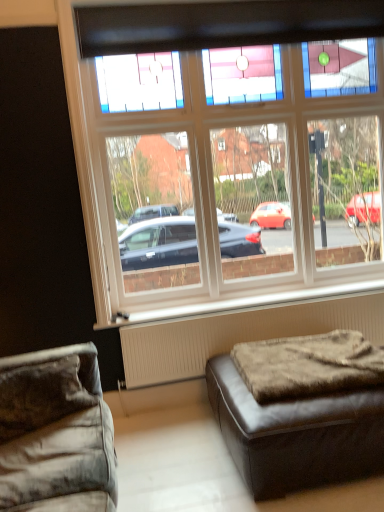
Question: From a real-world perspective, is white textured radiator at lower right above or below clear glass window at upper center?

Choices:
 (A) above
 (B) below

Answer: (B)

Question: Visually, is white textured radiator at lower right positioned to the left or to the right of clear glass window at upper center?

Choices:
 (A) left
 (B) right

Answer: (B)

Question: Estimate the real-world distances between objects in this image. Which object is closer to the brown leather ottoman at lower right, which ranks as the first studio couch in right-to-left order?

Choices:
 (A) velvet fabric studio couch at lower left, which is the 1th studio couch in left-to-right order
 (B) white textured radiator at lower right
 (C) brown fuzzy ottoman at lower right
 (D) clear glass window at upper center

Answer: (C)

Question: Estimate the real-world distances between objects in this image. Which object is closer to the white textured radiator at lower right?

Choices:
 (A) velvet fabric studio couch at lower left, which is the second studio couch from right to left
 (B) clear glass window at upper center
 (C) brown fuzzy ottoman at lower right
 (D) brown leather ottoman at lower right, the 2th studio couch in the left-to-right sequence

Answer: (C)